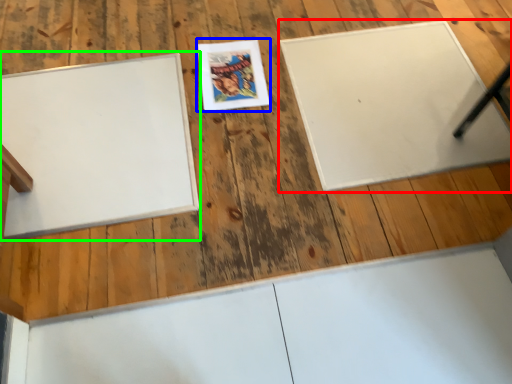
Question: Which object is positioned farthest from bulletin board (highlighted by a red box)? Select from comic book (highlighted by a blue box) and bulletin board (highlighted by a green box).

Choices:
 (A) comic book
 (B) bulletin board

Answer: (B)